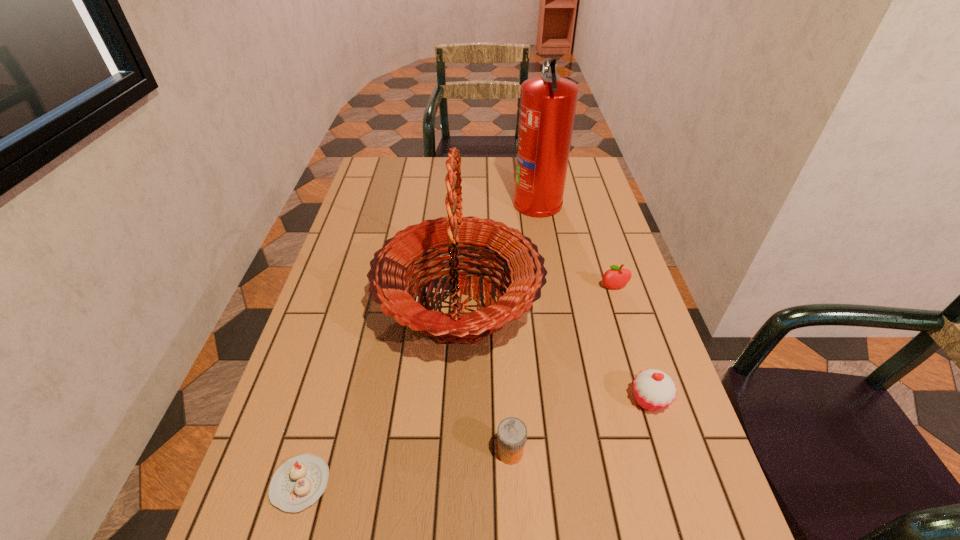
Where is `free space between the farthest object and the medicine`? This screenshot has height=540, width=960. free space between the farthest object and the medicine is located at coordinates pos(524,327).

At what (x,y) coordinates should I click in order to perform the action: click on blank region between the basket and the nearer cupcake. Please return your answer as a coordinate pair (x, y). Looking at the image, I should click on (380, 395).

Locate an element on the screen. The image size is (960, 540). empty space that is in between the shortest object and the basket is located at coordinates (380, 395).

Find the location of `unoccupied area between the apple and the medicine`. unoccupied area between the apple and the medicine is located at coordinates (562, 370).

At what (x,y) coordinates should I click in order to perform the action: click on vacant region between the apple and the farthest object. Please return your answer as a coordinate pair (x, y). This screenshot has width=960, height=540. Looking at the image, I should click on (576, 245).

Locate which object ranks fourth in proximity to the third nearest object. Please provide its 2D coordinates. Your answer should be formatted as a tuple, i.e. [(x, y)], where the tuple contains the x and y coordinates of a point satisfying the conditions above.

[(297, 484)]

Select which object is the second closest to the medicine. Please provide its 2D coordinates. Your answer should be formatted as a tuple, i.e. [(x, y)], where the tuple contains the x and y coordinates of a point satisfying the conditions above.

[(654, 390)]

This screenshot has width=960, height=540. What are the coordinates of `free space that satisfies the following two spatial constraints: 1. on the instruction side of the fire extinguisher; 2. on the left side of the taller cupcake` in the screenshot? It's located at click(x=571, y=400).

The width and height of the screenshot is (960, 540). Identify the location of blank space that satisfies the following two spatial constraints: 1. on the instruction side of the farthest object; 2. on the front side of the second tallest object. (555, 307).